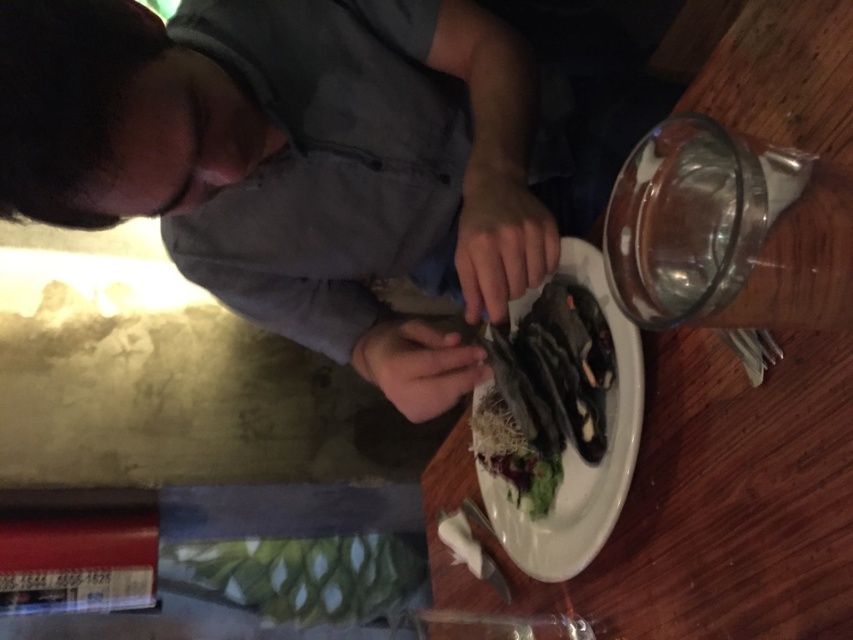
Question: Does gray matte shirt at center appear under wooden table at center?

Choices:
 (A) no
 (B) yes

Answer: (A)

Question: Among these objects, which one is farthest from the camera?

Choices:
 (A) wooden table at center
 (B) gray matte shirt at center
 (C) shiny silver platter at center

Answer: (C)

Question: Is gray matte shirt at center further to camera compared to wooden table at center?

Choices:
 (A) no
 (B) yes

Answer: (B)

Question: Which object is farther from the camera taking this photo?

Choices:
 (A) wooden table at center
 (B) gray matte shirt at center
 (C) shiny silver platter at center

Answer: (C)

Question: Does gray matte shirt at center come in front of wooden table at center?

Choices:
 (A) no
 (B) yes

Answer: (A)

Question: Which of the following is the closest to the observer?

Choices:
 (A) gray matte shirt at center
 (B) shiny silver platter at center

Answer: (A)